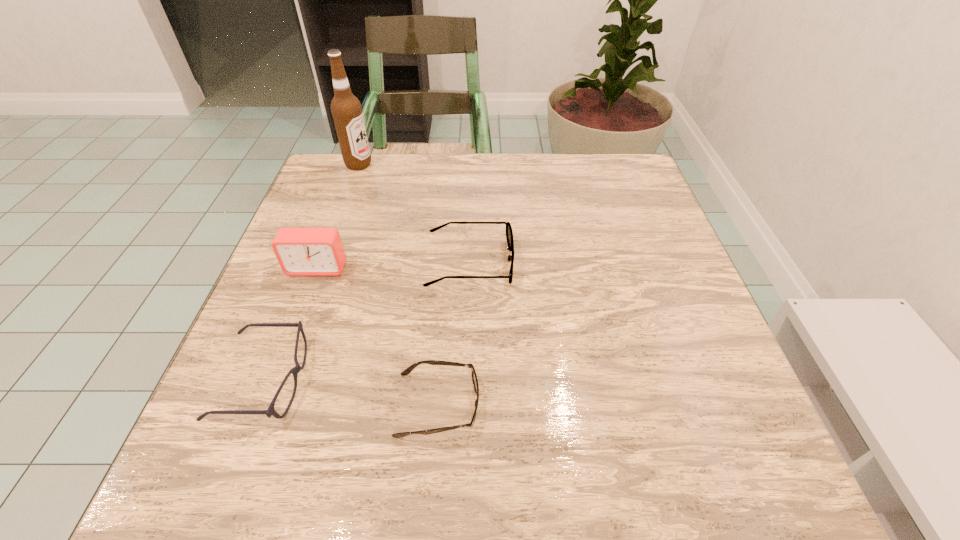
Where is `free area in between the shortest spectacles and the farthest object`? The image size is (960, 540). free area in between the shortest spectacles and the farthest object is located at coordinates (398, 285).

Locate an element on the screen. The height and width of the screenshot is (540, 960). object that is the second nearest to the shortest object is located at coordinates (509, 233).

Locate an element on the screen. This screenshot has height=540, width=960. the third closest object to the second tallest object is located at coordinates point(407,371).

Choose which spectacles is the nearest neighbor to the leftmost spectacles. Please provide its 2D coordinates. Your answer should be formatted as a tuple, i.e. [(x, y)], where the tuple contains the x and y coordinates of a point satisfying the conditions above.

[(407, 371)]

Where is `spectacles that stands as the closest to the leftmost spectacles`? spectacles that stands as the closest to the leftmost spectacles is located at coordinates (407, 371).

The width and height of the screenshot is (960, 540). Find the location of `free space that satisfies the following two spatial constraints: 1. on the front-facing side of the farthest spectacles; 2. on the front-facing side of the fourth shortest object`. free space that satisfies the following two spatial constraints: 1. on the front-facing side of the farthest spectacles; 2. on the front-facing side of the fourth shortest object is located at coordinates (469, 268).

You are a GUI agent. You are given a task and a screenshot of the screen. Output one action in this format:
    pyautogui.click(x=<x>, y=<y>)
    Task: Click on the vacant space that satisfies the following two spatial constraints: 1. on the label of the farthest object; 2. on the front-facing side of the second tallest object
    This screenshot has width=960, height=540.
    Given the screenshot: What is the action you would take?
    pyautogui.click(x=323, y=268)

Identify the location of free spot that satisfies the following two spatial constraints: 1. on the label of the farthest object; 2. on the front-facing side of the fourth shortest object. The width and height of the screenshot is (960, 540). (323, 268).